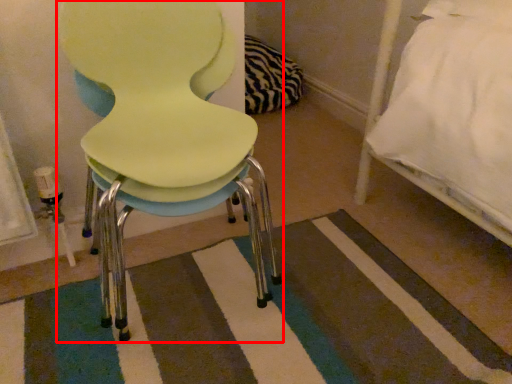
Question: Observing the image, what is the correct spatial positioning of chair (annotated by the red box) in reference to mat?

Choices:
 (A) left
 (B) right

Answer: (A)